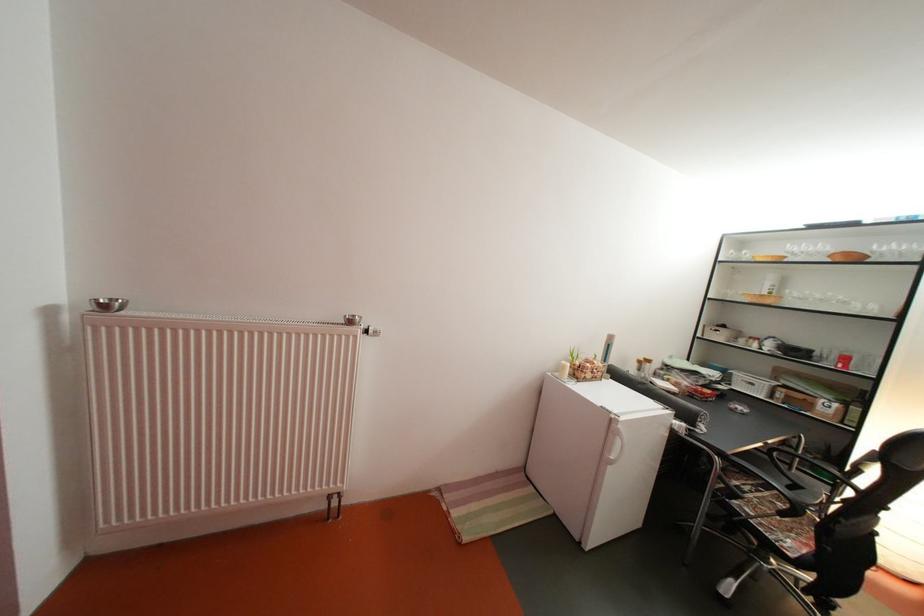
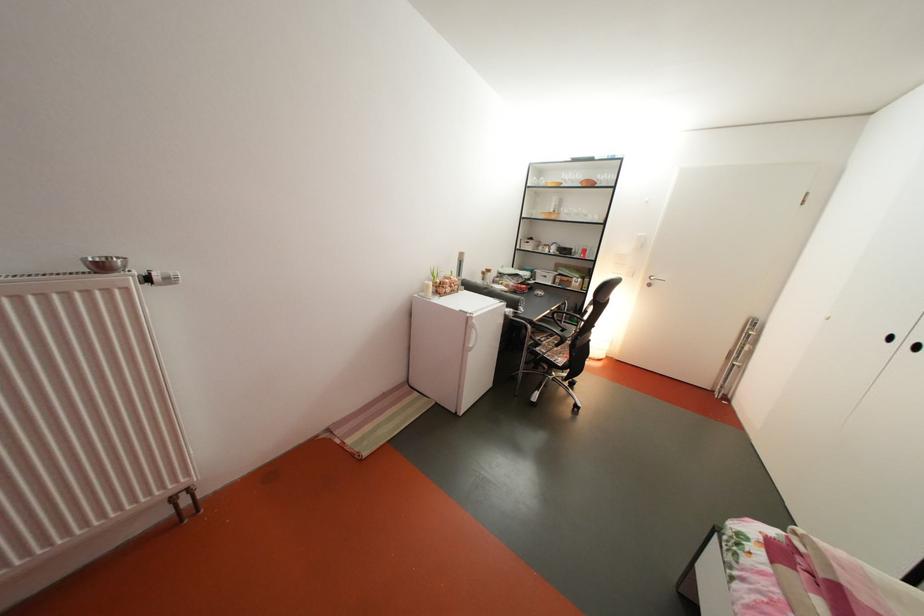
Find the pixel in the second image that matches the point at 857,310 in the first image.

(598, 222)